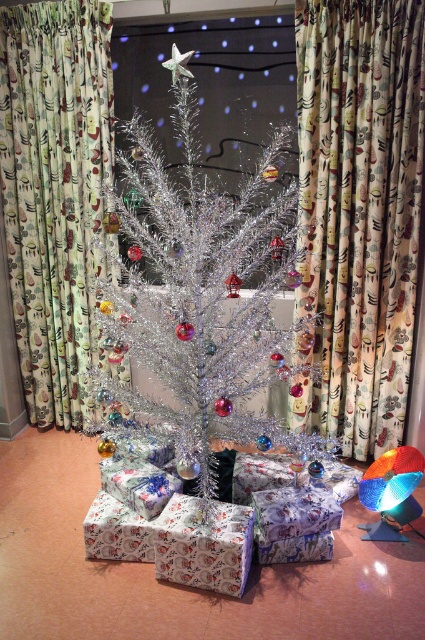
Question: Is floral fabric curtain at center positioned behind floral fabric curtain at left?

Choices:
 (A) no
 (B) yes

Answer: (A)

Question: Can you confirm if shiny metallic tree at center is positioned to the right of floral fabric curtain at left?

Choices:
 (A) no
 (B) yes

Answer: (B)

Question: Which point appears closest to the camera in this image?

Choices:
 (A) (118, 348)
 (B) (388, 216)
 (C) (68, 113)

Answer: (A)

Question: Which point is farther to the camera?

Choices:
 (A) (337, 51)
 (B) (36, 208)

Answer: (B)

Question: Does floral fabric curtain at center have a larger size compared to shiny metallic tree at center?

Choices:
 (A) yes
 (B) no

Answer: (B)

Question: Which point appears farthest from the camera in this image?

Choices:
 (A) (59, 72)
 (B) (190, 266)

Answer: (A)